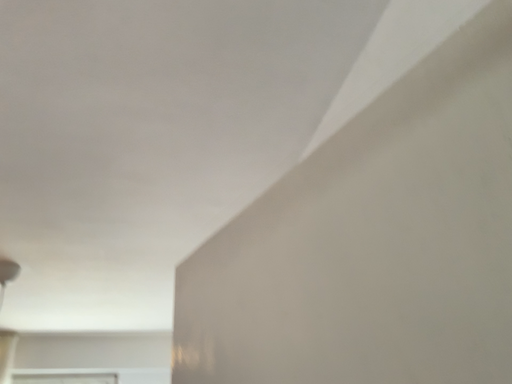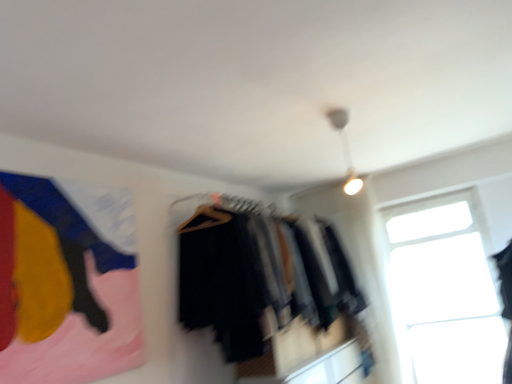
Question: Which way did the camera rotate in the video?

Choices:
 (A) rotated downward
 (B) rotated upward

Answer: (A)